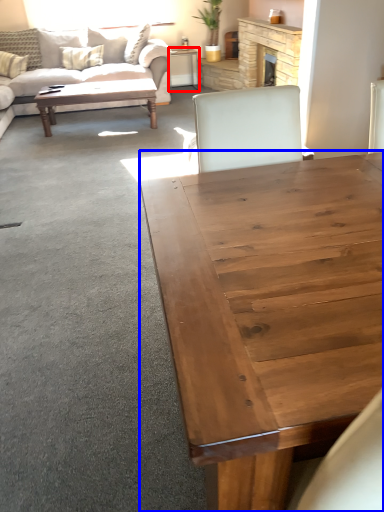
Question: Which object appears closest to the camera in this image, desk (highlighted by a red box) or coffee table (highlighted by a blue box)?

Choices:
 (A) desk
 (B) coffee table

Answer: (B)